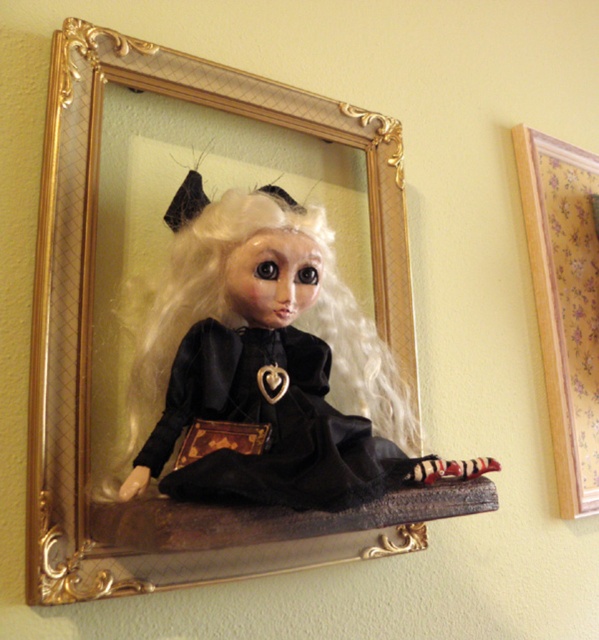
Question: Which object is the farthest from the black velvet dress at center?

Choices:
 (A) goldwoodenpicture frame at center
 (B) white silky hair at center
 (C) wooden at upper right

Answer: (C)

Question: Which point is farther to the camera?

Choices:
 (A) [x=313, y=352]
 (B) [x=388, y=336]
 (C) [x=168, y=332]
 (D) [x=540, y=237]

Answer: (D)

Question: Considering the real-world distances, which object is closest to the black velvet dress at center?

Choices:
 (A) white silky hair at center
 (B) goldwoodenpicture frame at center
 (C) wooden at upper right

Answer: (A)

Question: Is black velvet dress at center further to the viewer compared to white silky hair at center?

Choices:
 (A) yes
 (B) no

Answer: (B)

Question: In this image, where is goldwoodenpicture frame at center located relative to white silky hair at center?

Choices:
 (A) left
 (B) right

Answer: (B)

Question: Can you confirm if black velvet dress at center is thinner than wooden at upper right?

Choices:
 (A) no
 (B) yes

Answer: (A)